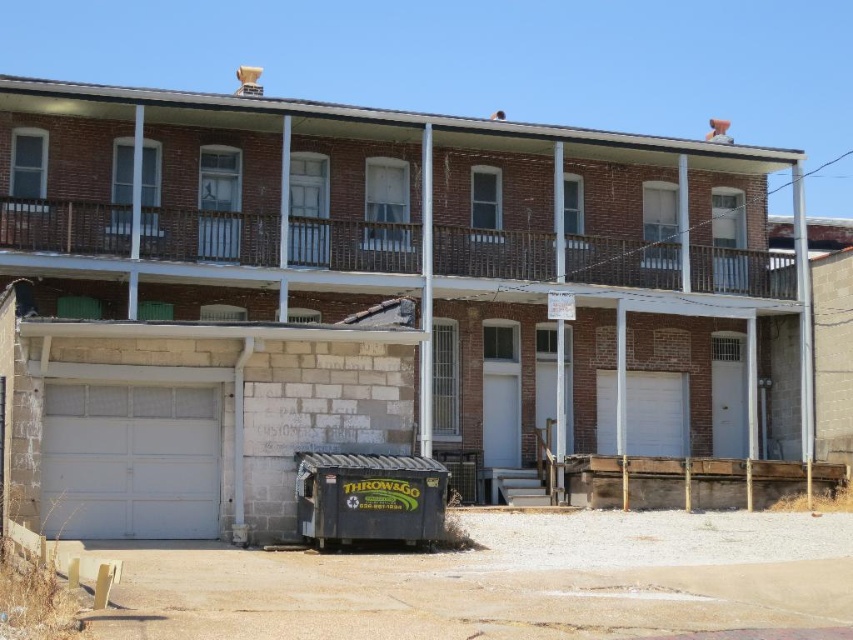
Is white matte garage door at lower left wider than white smooth garage door at lower left?

Yes, white matte garage door at lower left is wider than white smooth garage door at lower left.

Is white matte garage door at lower left shorter than white smooth garage door at lower left?

No, white matte garage door at lower left is not shorter than white smooth garage door at lower left.

Between point (100, 428) and point (172, 529), which one is positioned in front?

Point (100, 428) is in front.

What are the coordinates of `white matte garage door at lower left` in the screenshot? It's located at (357, 292).

Measure the distance between white smooth garage door at lower left and camera.

They are 18.74 meters apart.

Who is more distant from viewer, (88, 508) or (637, 396)?

Point (637, 396)

Between point (158, 426) and point (631, 429), which one is positioned behind?

The point (631, 429) is behind.

Locate an element on the screen. This screenshot has width=853, height=640. white smooth garage door at lower left is located at coordinates (129, 461).

Is white matte garage door at lower left wider than white matte garage door at center?

Yes, white matte garage door at lower left is wider than white matte garage door at center.

How distant is white matte garage door at lower left from white matte garage door at center?

white matte garage door at lower left and white matte garage door at center are 8.97 feet apart from each other.

Measure the distance between white matte garage door at lower left and camera.

A distance of 18.14 meters exists between white matte garage door at lower left and camera.

The image size is (853, 640). Find the location of `white matte garage door at lower left`. white matte garage door at lower left is located at coordinates (357, 292).